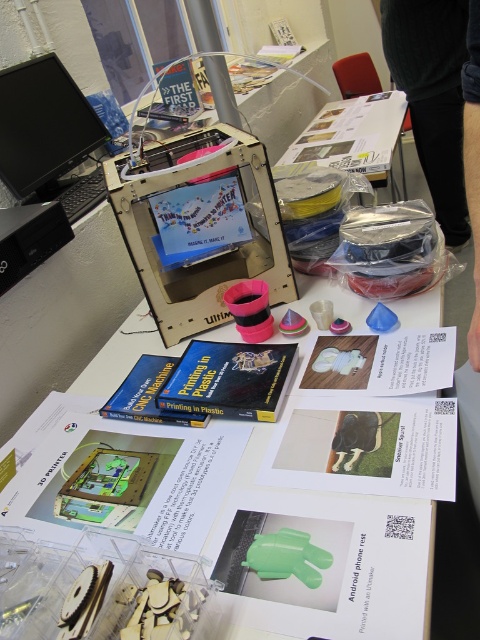
You are setting up a new 3D printer and need to place the keyboard closer to the user. Based on the current setup, is the matte plastic 3d printer at center positioned above or below the black plastic keyboard at left?

The matte plastic 3d printer at center is below the black plastic keyboard at left.

You are setting up a workstation and need to place a black plastic keyboard at left closer to the matte plastic 3d printer at center. Which direction should you move the keyboard?

The matte plastic 3d printer at center is positioned on the right side of black plastic keyboard at left. To move the keyboard closer to the printer, you should move it to the right.